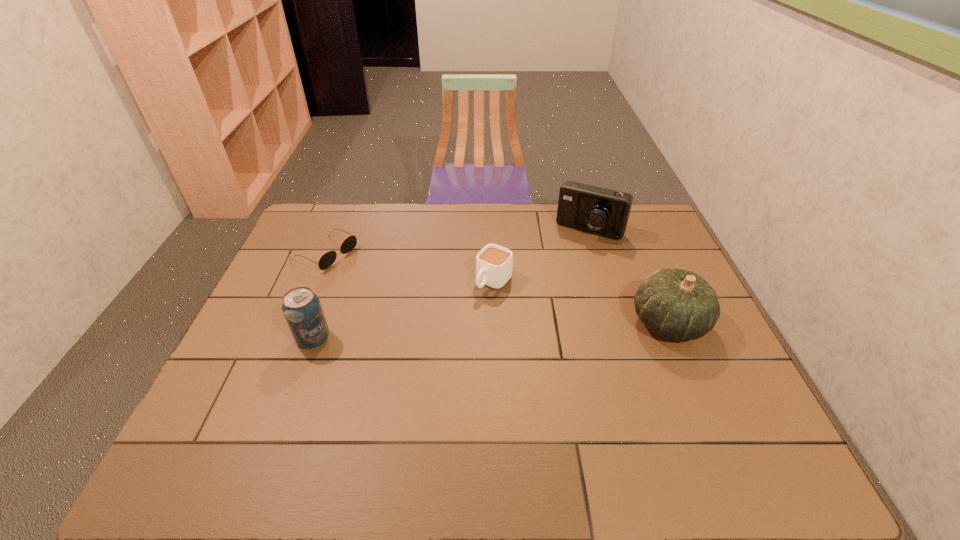
The height and width of the screenshot is (540, 960). In order to click on sunglasses that is at the left edge in this screenshot , I will do `click(327, 259)`.

Locate an element on the screen. The height and width of the screenshot is (540, 960). gourd positioned at the right edge is located at coordinates (677, 304).

The width and height of the screenshot is (960, 540). I want to click on camera that is at the right edge, so click(x=597, y=210).

The image size is (960, 540). Find the location of `object that is positioned at the far left corner`. object that is positioned at the far left corner is located at coordinates (327, 259).

Locate an element on the screen. object located in the far right corner section of the desktop is located at coordinates (597, 210).

In the image, there is a desktop. Where is `vacant space at the far edge`? The width and height of the screenshot is (960, 540). vacant space at the far edge is located at coordinates (550, 217).

You are a GUI agent. You are given a task and a screenshot of the screen. Output one action in this format:
    pyautogui.click(x=<x>, y=<y>)
    Task: Click on the vacant area at the near edge
    This screenshot has width=960, height=540.
    Given the screenshot: What is the action you would take?
    pyautogui.click(x=377, y=413)

The width and height of the screenshot is (960, 540). In the image, there is a desktop. What are the coordinates of `vacant space at the left edge` in the screenshot? It's located at (292, 255).

Image resolution: width=960 pixels, height=540 pixels. I want to click on free point at the right edge, so tap(650, 262).

Where is `vacant space at the far left corner of the desktop`? Image resolution: width=960 pixels, height=540 pixels. vacant space at the far left corner of the desktop is located at coordinates (324, 222).